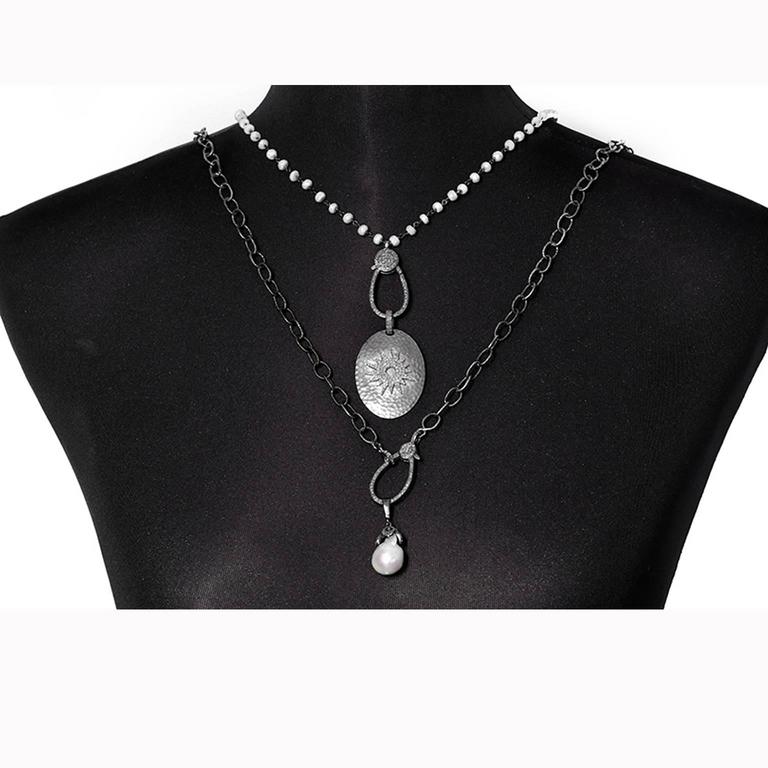
At what (x,y) coordinates should I click in order to perform the action: click on velvet jewelry display. Please return your answer as a coordinate pair (x, y). Image resolution: width=768 pixels, height=768 pixels. Looking at the image, I should click on (587, 412).